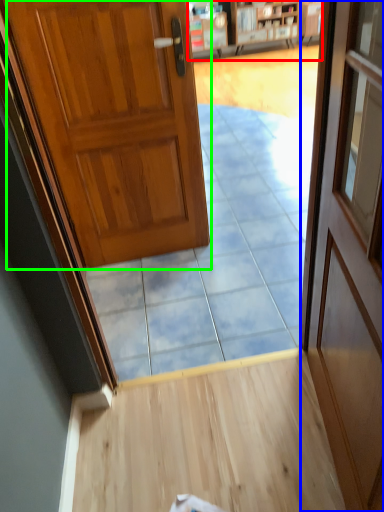
Question: Estimate the real-world distances between objects in this image. Which object is closer to bookshelf (highlighted by a red box), door (highlighted by a blue box) or door (highlighted by a green box)?

Choices:
 (A) door
 (B) door

Answer: (B)